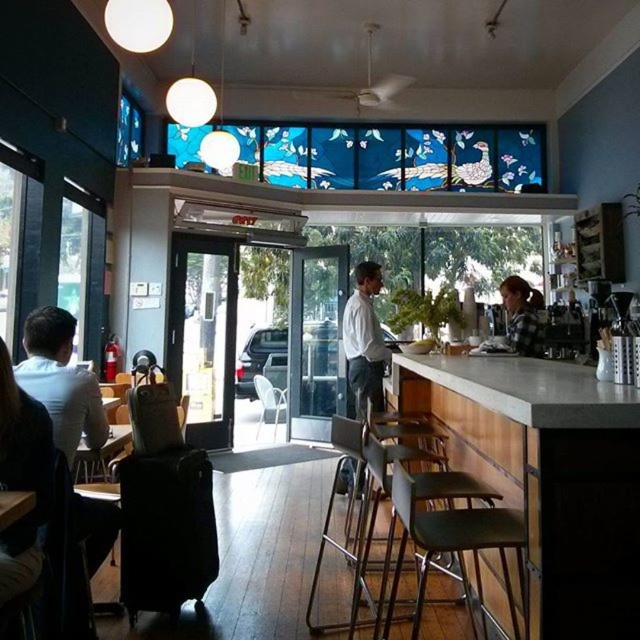
Question: Can you confirm if smooth concrete bar at center is positioned below metallic silver bar stool at center?

Choices:
 (A) no
 (B) yes

Answer: (A)

Question: Estimate the real-world distances between objects in this image. Which object is closer to the smooth concrete bar at center?

Choices:
 (A) plaid shirt at counter
 (B) metallic silver bar stool at center

Answer: (B)

Question: Based on their relative distances, which object is farther from the white shirt at center?

Choices:
 (A) metallic silver bar stool at center
 (B) white shirt at left
 (C) plaid shirt at counter
 (D) smooth concrete bar at center

Answer: (B)

Question: Among these objects, which one is nearest to the camera?

Choices:
 (A) white shirt at center
 (B) smooth concrete bar at center

Answer: (B)

Question: Does metallic silver bar stool at center appear over white shirt at left?

Choices:
 (A) yes
 (B) no

Answer: (B)

Question: Considering the relative positions of smooth concrete bar at center and metallic silver bar stool at center in the image provided, where is smooth concrete bar at center located with respect to metallic silver bar stool at center?

Choices:
 (A) left
 (B) right

Answer: (B)